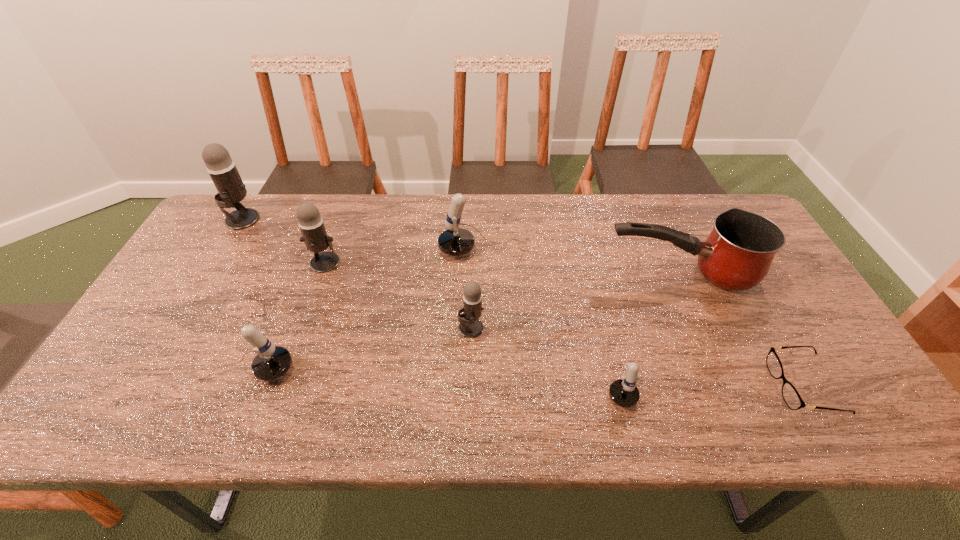
Point out which white microphone is positioned as the nearest to the spectacles. Please provide its 2D coordinates. Your answer should be formatted as a tuple, i.e. [(x, y)], where the tuple contains the x and y coordinates of a point satisfying the conditions above.

[(623, 392)]

You are a GUI agent. You are given a task and a screenshot of the screen. Output one action in this format:
    pyautogui.click(x=<x>, y=<y>)
    Task: Click on the white microphone that stands as the closest to the biggest white microphone
    Image resolution: width=960 pixels, height=540 pixels.
    Given the screenshot: What is the action you would take?
    pyautogui.click(x=623, y=392)

Find the location of `free spot that satisfies the following two spatial constraints: 1. on the front side of the second white microphone from left to right; 2. on the left side of the shortest microphone`. free spot that satisfies the following two spatial constraints: 1. on the front side of the second white microphone from left to right; 2. on the left side of the shortest microphone is located at coordinates (484, 379).

What are the coordinates of `free location that satisfies the following two spatial constraints: 1. on the back side of the biggest white microphone; 2. on the left side of the nearest gray microphone` in the screenshot? It's located at (472, 250).